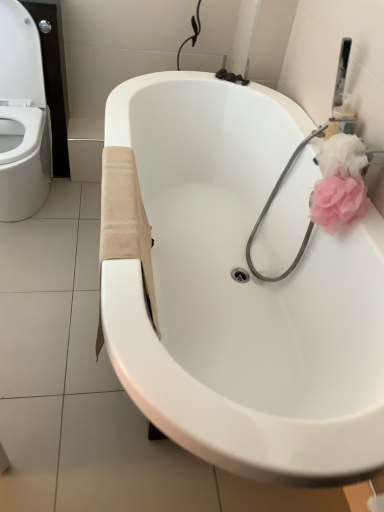
Image resolution: width=384 pixels, height=512 pixels. I want to click on white glossy bathtub at center, so click(242, 293).

What is the approximate width of white glossy bathtub at center?

white glossy bathtub at center is 30.36 inches wide.

Describe the element at coordinates (242, 293) in the screenshot. I see `white glossy bathtub at center` at that location.

Describe the element at coordinates (337, 202) in the screenshot. I see `pink fabric rose at right` at that location.

You are a GUI agent. You are given a task and a screenshot of the screen. Output one action in this format:
    pyautogui.click(x=<x>, y=<y>)
    Task: Click on the pink fabric rose at right
    This screenshot has height=512, width=384.
    Given the screenshot: What is the action you would take?
    tap(337, 202)

Find the location of a particular element. white glossy bathtub at center is located at coordinates (242, 293).

Consider the image. Visually, is pink fabric rose at right positioned to the left or to the right of white glossy bathtub at center?

pink fabric rose at right is to the right of white glossy bathtub at center.

Which object is more forward, pink fabric rose at right or white glossy bathtub at center?

Positioned in front is white glossy bathtub at center.

Considering the positions of points (309, 206) and (248, 475), is point (309, 206) farther from camera compared to point (248, 475)?

Yes, point (309, 206) is farther from viewer.

From the image's perspective, is pink fabric rose at right on white glossy bathtub at center?

Yes.

From a real-world perspective, is pink fabric rose at right located beneath white glossy bathtub at center?

No.

Can you confirm if pink fabric rose at right is wider than white glossy bathtub at center?

In fact, pink fabric rose at right might be narrower than white glossy bathtub at center.

In the scene shown: Considering the sizes of pink fabric rose at right and white glossy bathtub at center in the image, is pink fabric rose at right taller or shorter than white glossy bathtub at center?

Clearly, pink fabric rose at right is shorter compared to white glossy bathtub at center.

Considering the sizes of objects pink fabric rose at right and white glossy bathtub at center in the image provided, who is bigger, pink fabric rose at right or white glossy bathtub at center?

Bigger between the two is white glossy bathtub at center.

Choose the correct answer: Is pink fabric rose at right inside white glossy bathtub at center or outside it?

pink fabric rose at right fits inside white glossy bathtub at center.

Is pink fabric rose at right not near white glossy bathtub at center?

No, pink fabric rose at right is not far from white glossy bathtub at center.

From the picture: Is pink fabric rose at right facing towards white glossy bathtub at center?

No, pink fabric rose at right is not turned towards white glossy bathtub at center.

What's the angular difference between pink fabric rose at right and white glossy bathtub at center's facing directions?

The angle between the facing direction of pink fabric rose at right and the facing direction of white glossy bathtub at center is 84.5 degrees.

Measure the distance from pink fabric rose at right to white glossy bathtub at center.

pink fabric rose at right and white glossy bathtub at center are 18.01 inches apart.

You are a GUI agent. You are given a task and a screenshot of the screen. Output one action in this format:
    pyautogui.click(x=<x>, y=<y>)
    Task: Click on the bathtub beneath the pink fabric rose at right (from a real-world perspective)
    The height and width of the screenshot is (512, 384).
    Given the screenshot: What is the action you would take?
    pyautogui.click(x=242, y=293)

Can you confirm if white glossy bathtub at center is positioned to the right of pink fabric rose at right?

No, white glossy bathtub at center is not to the right of pink fabric rose at right.

Is white glossy bathtub at center in front of or behind pink fabric rose at right in the image?

Visually, white glossy bathtub at center is located in front of pink fabric rose at right.

Does point (228, 161) lie behind point (343, 188)?

Yes, it is behind point (343, 188).

From the image's perspective, does white glossy bathtub at center appear higher than pink fabric rose at right?

Actually, white glossy bathtub at center appears below pink fabric rose at right in the image.

From a real-world perspective, is white glossy bathtub at center above or below pink fabric rose at right?

Clearly, from a real-world perspective, white glossy bathtub at center is below pink fabric rose at right.

Is white glossy bathtub at center wider than pink fabric rose at right?

Correct, the width of white glossy bathtub at center exceeds that of pink fabric rose at right.

Can you confirm if white glossy bathtub at center is shorter than pink fabric rose at right?

No.

Which of these two, white glossy bathtub at center or pink fabric rose at right, is bigger?

Bigger between the two is white glossy bathtub at center.

Is white glossy bathtub at center not within pink fabric rose at right?

Yes, white glossy bathtub at center is not within pink fabric rose at right.

Can you see white glossy bathtub at center touching pink fabric rose at right?

They are not placed beside each other.

Is white glossy bathtub at center positioned with its back to pink fabric rose at right?

No, white glossy bathtub at center's orientation is not away from pink fabric rose at right.

From the picture: How different are the orientations of white glossy bathtub at center and pink fabric rose at right in degrees?

white glossy bathtub at center and pink fabric rose at right are facing 84.5 degrees away from each other.

Find the location of a particular element. rose located behind the white glossy bathtub at center is located at coordinates (337, 202).

The width and height of the screenshot is (384, 512). Identify the location of bathtub that is below the pink fabric rose at right (from the image's perspective). [242, 293].

This screenshot has height=512, width=384. What are the coordinates of `rose above the white glossy bathtub at center (from a real-world perspective)` in the screenshot? It's located at click(x=337, y=202).